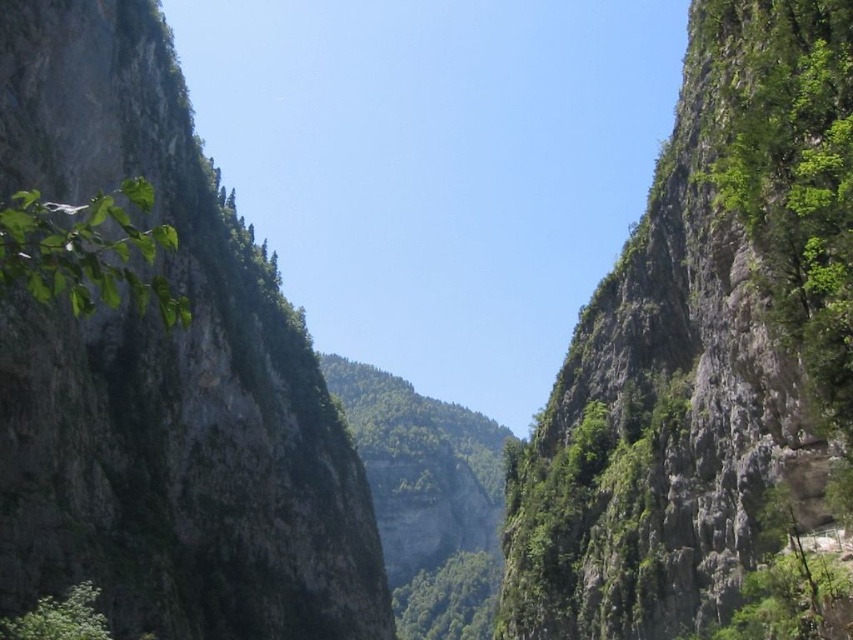
Who is positioned more to the left, green rocky cliff at center or green rough rock at left?

green rough rock at left

Does green rocky cliff at center have a greater width compared to green rough rock at left?

Incorrect, green rocky cliff at center's width does not surpass green rough rock at left's.

Is point (500, 598) in front of point (229, 486)?

Yes.

Image resolution: width=853 pixels, height=640 pixels. Find the location of `green rocky cliff at center`. green rocky cliff at center is located at coordinates (703, 352).